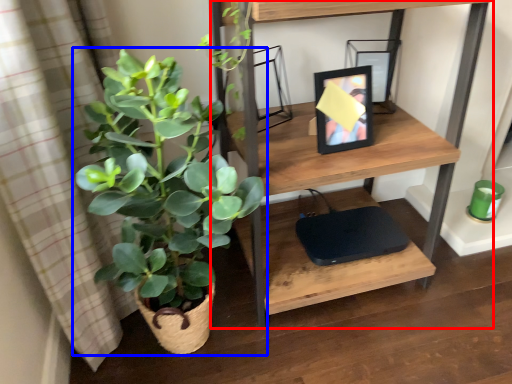
Question: Which object is further to the camera taking this photo, shelf (highlighted by a red box) or houseplant (highlighted by a blue box)?

Choices:
 (A) shelf
 (B) houseplant

Answer: (A)